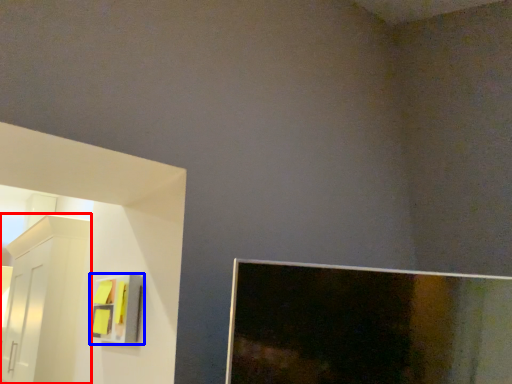
Question: Which point is further to the camera, furniture (highlighted by a red box) or cabinet (highlighted by a blue box)?

Choices:
 (A) furniture
 (B) cabinet

Answer: (A)